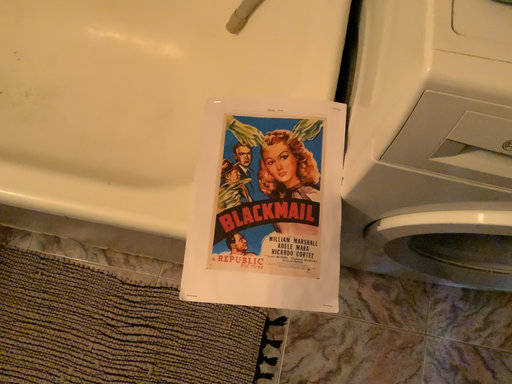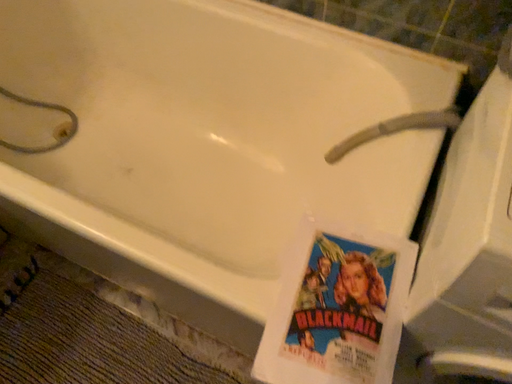
Question: Which way did the camera rotate in the video?

Choices:
 (A) rotated downward
 (B) rotated upward

Answer: (B)